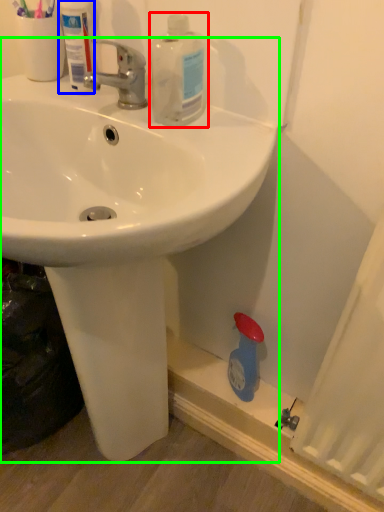
Question: Which object is positioned closest to cleaning product (highlighted by a red box)? Select from mouthwash (highlighted by a blue box) and sink (highlighted by a green box).

Choices:
 (A) mouthwash
 (B) sink

Answer: (A)